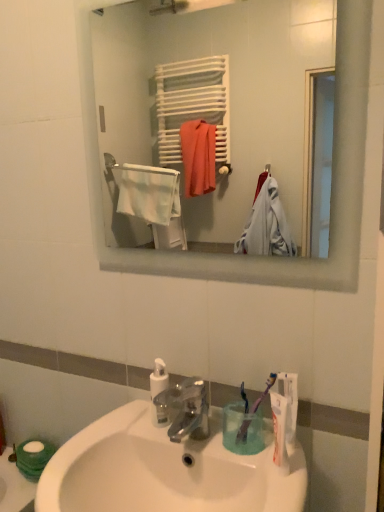
Identify the location of free space to the left of purple plastic toothbrush at lower center, which ranks as the 2th toothbrush in right-to-left order. Image resolution: width=384 pixels, height=512 pixels. (195, 433).